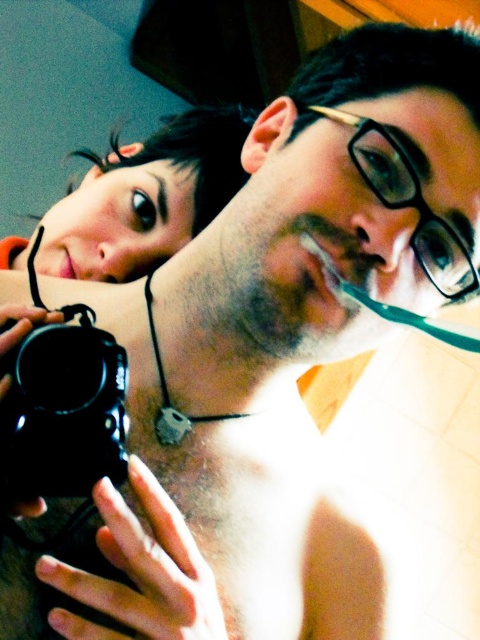
You are analyzing a selfie image. You need to determine the exact 2D coordinates of the matte black hair at upper left. What are its coordinates?

The matte black hair at upper left is located at the 2D coordinates of point (148,196).

You are taking a photo with the black plastic camera at lower left and notice the pink matte lips at upper left in the frame. Which object is taller in the image?

The black plastic camera at lower left is taller than the pink matte lips at upper left.

You are taking a photo of two friends using a camera. You notice two points in the image at coordinates point (x=118, y=362) and point (x=69, y=257). Which point is closer to the camera?

Point (x=118, y=362) is in front of point (x=69, y=257), so it is closer to the camera.